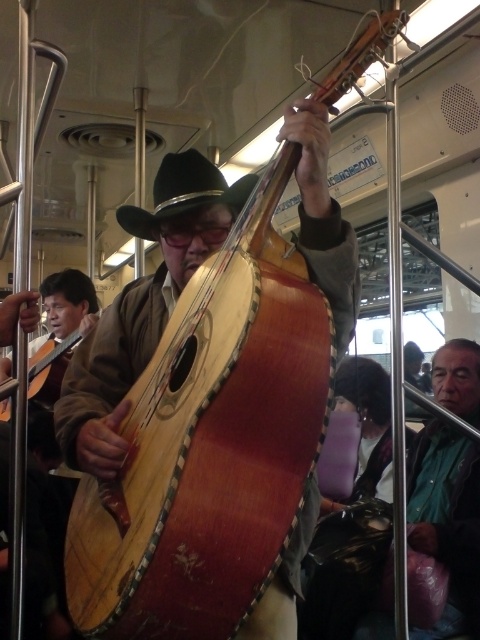
You are a passenger on a train and you see the wooden carved cello at center and the black felt fedora at center. Which object is positioned lower in the scene?

The wooden carved cello at center is positioned below the black felt fedora at center, so the wooden carved cello at center is lower.

You are a passenger on a train and see the wooden carved cello at center and the black felt fedora at center. Which object is positioned more to the right from your perspective?

Answer: The wooden carved cello at center is positioned to the right of the black felt fedora at center, so the wooden carved cello at center is more to the right.